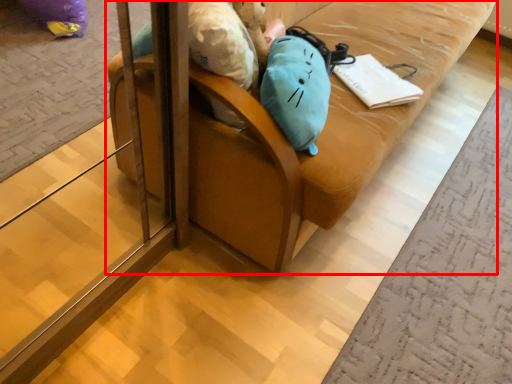
Question: Observing the image, what is the correct spatial positioning of furniture (annotated by the red box) in reference to notebook?

Choices:
 (A) right
 (B) left

Answer: (B)